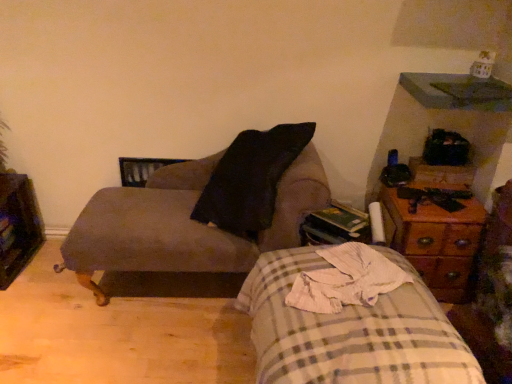
Locate an element on the screen. vacant space to the right of wooden dresser at left is located at coordinates (48, 275).